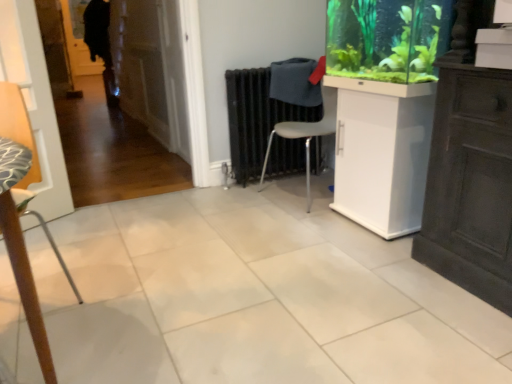
You are a GUI agent. You are given a task and a screenshot of the screen. Output one action in this format:
    pyautogui.click(x=<x>, y=<y>)
    Task: Click on the unoccupied area in front of gray plastic chair at center, marked as the first chair in a back-to-front arrangement
    
    Given the screenshot: What is the action you would take?
    pyautogui.click(x=310, y=223)